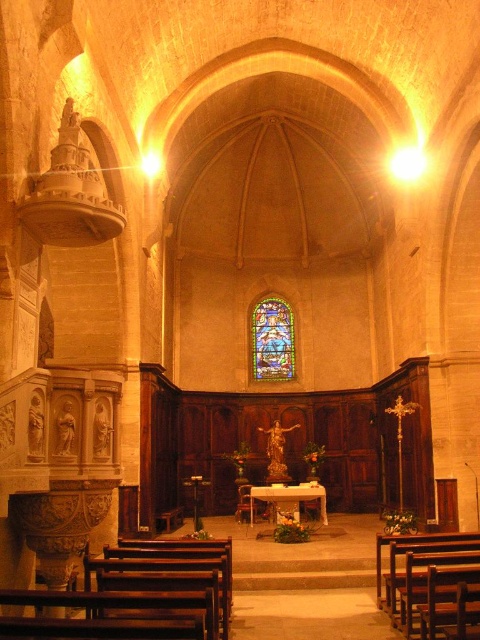
Who is more distant from viewer, (252, 326) or (288, 488)?

The point (252, 326) is more distant.

Consider the image. Is stained glass window at center shorter than white marble altar at center?

Incorrect, stained glass window at center's height does not fall short of white marble altar at center's.

Identify the location of stained glass window at center. (272, 340).

Locate an element on the screen. stained glass window at center is located at coordinates (272, 340).